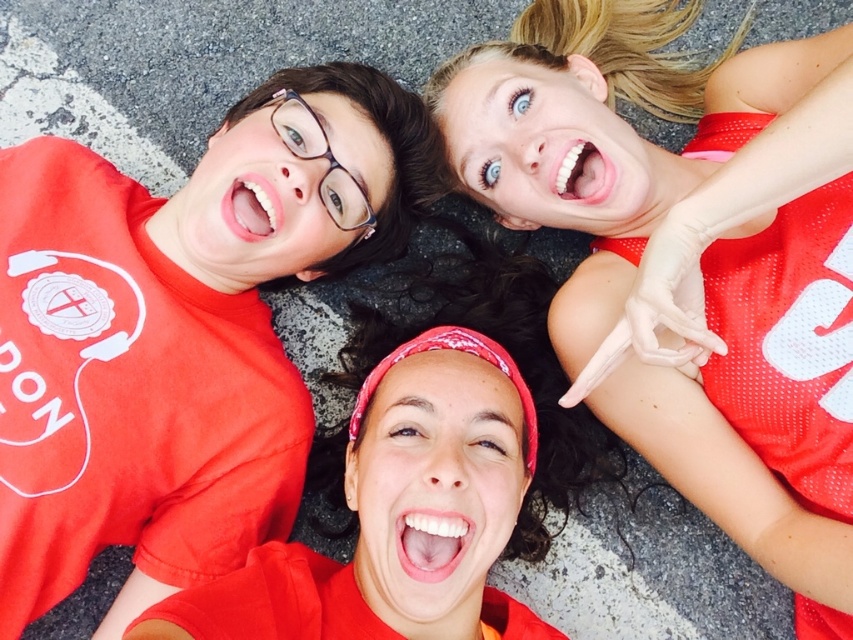
Question: In this image, where is matte red t-shirt at upper left located relative to matte red jersey at upper right?

Choices:
 (A) below
 (B) above

Answer: (A)

Question: Among these objects, which one is farthest from the camera?

Choices:
 (A) matte red jersey at upper right
 (B) matte red t-shirt at upper left

Answer: (B)

Question: Is matte red t-shirt at upper left wider than matte red jersey at upper right?

Choices:
 (A) no
 (B) yes

Answer: (B)

Question: Can you confirm if matte red t-shirt at upper left is positioned to the right of matte red jersey at upper right?

Choices:
 (A) yes
 (B) no

Answer: (B)